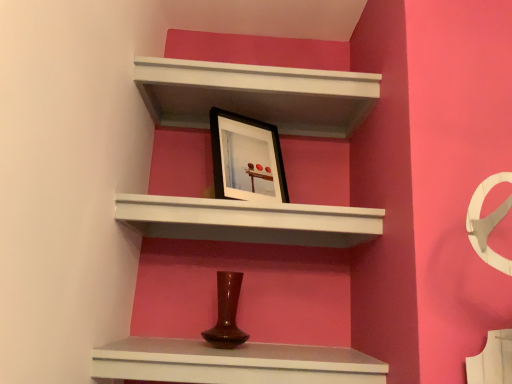
Question: Relative to white matte shelf at upper center, the 3th shelf in the bottom-to-top sequence, is white matte shelf at upper center, placed as the 2th shelf when sorted from bottom to top, in front or behind?

Choices:
 (A) front
 (B) behind

Answer: (A)

Question: Visually, is white matte shelf at upper center, placed as the 2th shelf when sorted from bottom to top, positioned to the left or to the right of white matte shelf at upper center, positioned as the 1th shelf in top-to-bottom order?

Choices:
 (A) left
 (B) right

Answer: (A)

Question: Which is farther from the black matte picture frame at upper center?

Choices:
 (A) white matte shelf at upper center, placed as the 2th shelf when sorted from bottom to top
 (B) white matte shelf at upper center, the 3th shelf in the bottom-to-top sequence
 (C) matte brown vase at center, arranged as the 1th shelf when ordered from the bottom

Answer: (C)

Question: Which object is positioned farthest from the black matte picture frame at upper center?

Choices:
 (A) matte brown vase at center, arranged as the 1th shelf when ordered from the bottom
 (B) white matte shelf at upper center, placed as the 2th shelf when sorted from bottom to top
 (C) white matte shelf at upper center, the 3th shelf in the bottom-to-top sequence

Answer: (A)